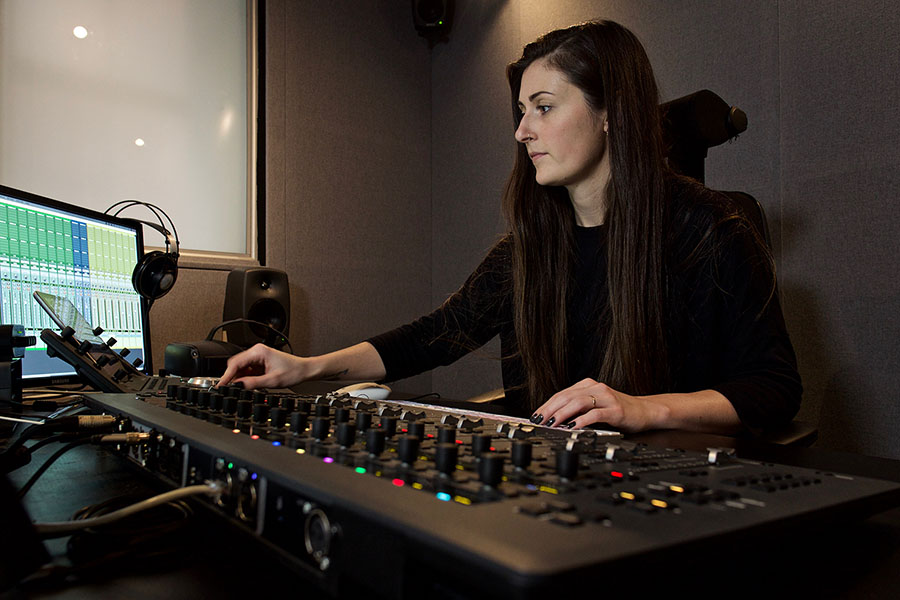
You are a GUI agent. You are given a task and a screenshot of the screen. Output one action in this format:
    pyautogui.click(x=<x>, y=<y>)
    Task: Click on the computer screen
    
    Given the screenshot: What is the action you would take?
    pyautogui.click(x=92, y=279)